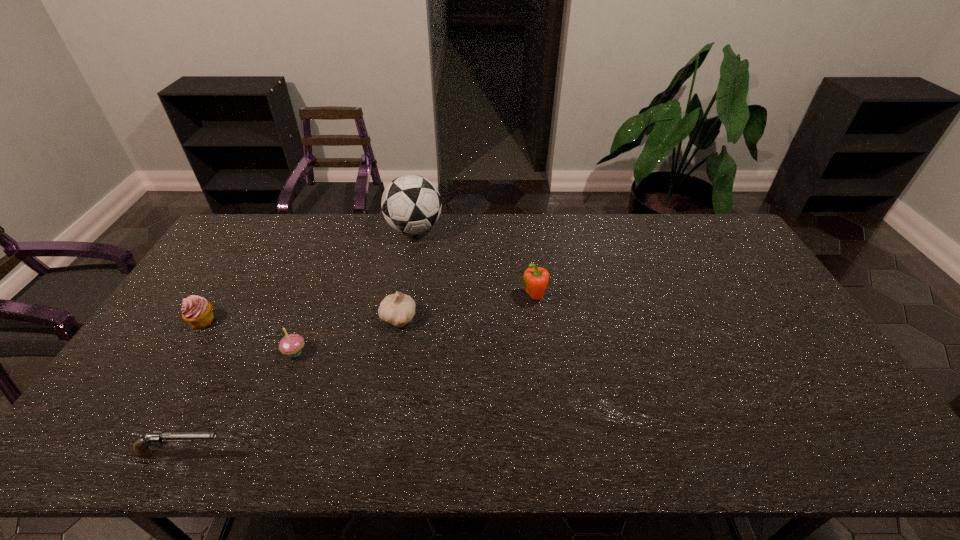
Identify the location of gun. This screenshot has width=960, height=540. (141, 447).

You are a GUI agent. You are given a task and a screenshot of the screen. Output one action in this format:
    pyautogui.click(x=<x>, y=<y>)
    Task: Click on the vacant space positioned on the surface of the soccer ball where the brand logo is visible
    This screenshot has width=960, height=540.
    Given the screenshot: What is the action you would take?
    pyautogui.click(x=513, y=229)

Identify the location of vacant space situated 0.100m on the right of the second tallest object. The image size is (960, 540). (579, 298).

Locate an element on the screen. vacant space located 0.120m on the left of the garlic is located at coordinates coord(339,319).

Identify the location of free space located on the back of the leftmost object. (233, 272).

In order to click on vacant space located 0.090m on the front of the right cupcake in this screenshot , I will do `click(280, 391)`.

The width and height of the screenshot is (960, 540). Find the location of `vacant space located 0.290m aiming along the barrel of the gun`. vacant space located 0.290m aiming along the barrel of the gun is located at coordinates (355, 454).

Locate an element on the screen. The image size is (960, 540). object present at the far edge is located at coordinates (411, 204).

This screenshot has height=540, width=960. Find the location of `object that is at the near edge`. object that is at the near edge is located at coordinates (141, 447).

Find the location of a particular element. This screenshot has width=960, height=540. cupcake that is positioned at the left edge is located at coordinates (196, 311).